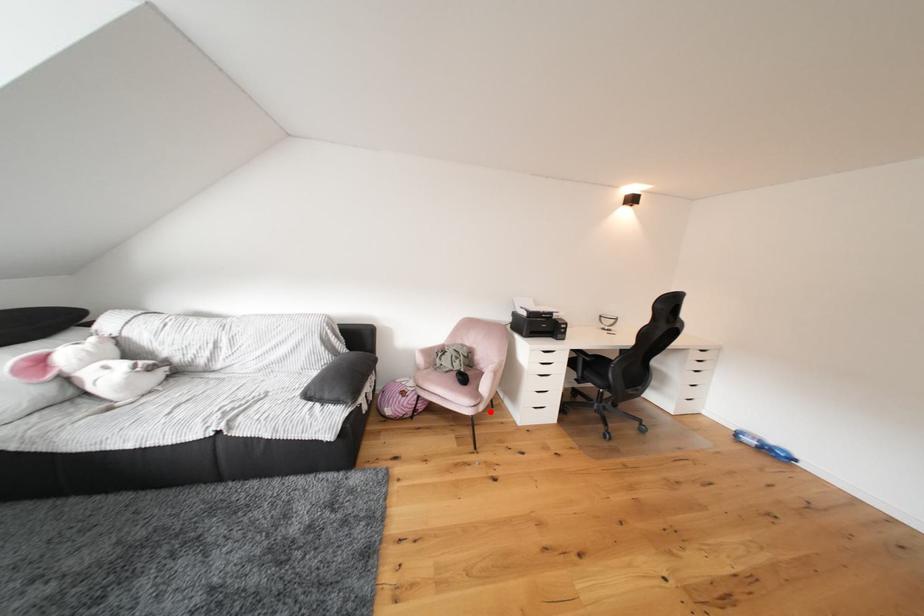
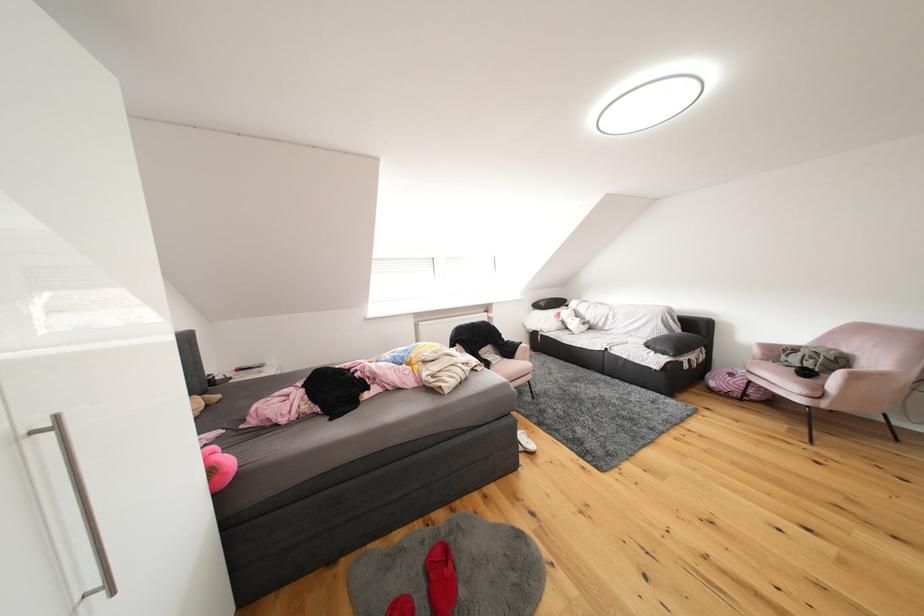
Find the pixel in the second image that matches the highlighted location in the first image.

(834, 408)